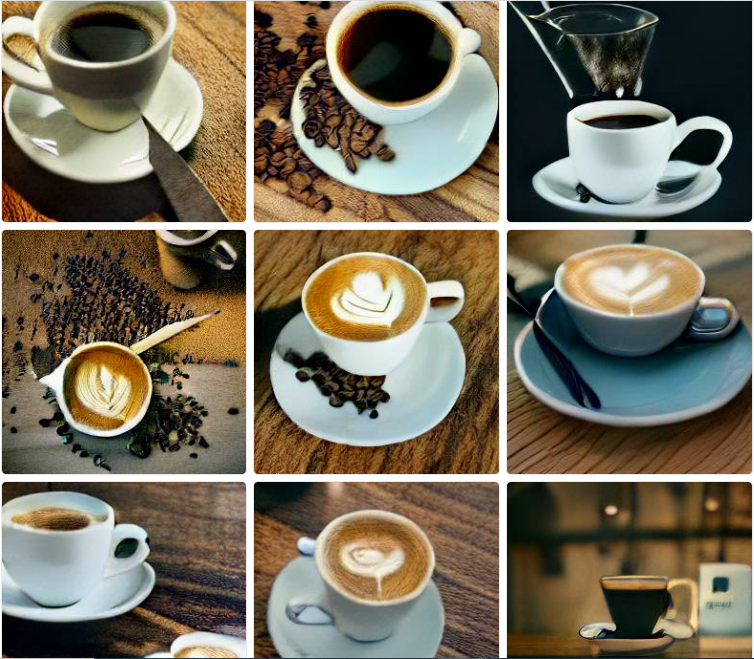
Locate an element on the screen. cups is located at coordinates (112, 82), (394, 113), (611, 159), (642, 331), (382, 362), (123, 437), (75, 559), (360, 606), (639, 592).